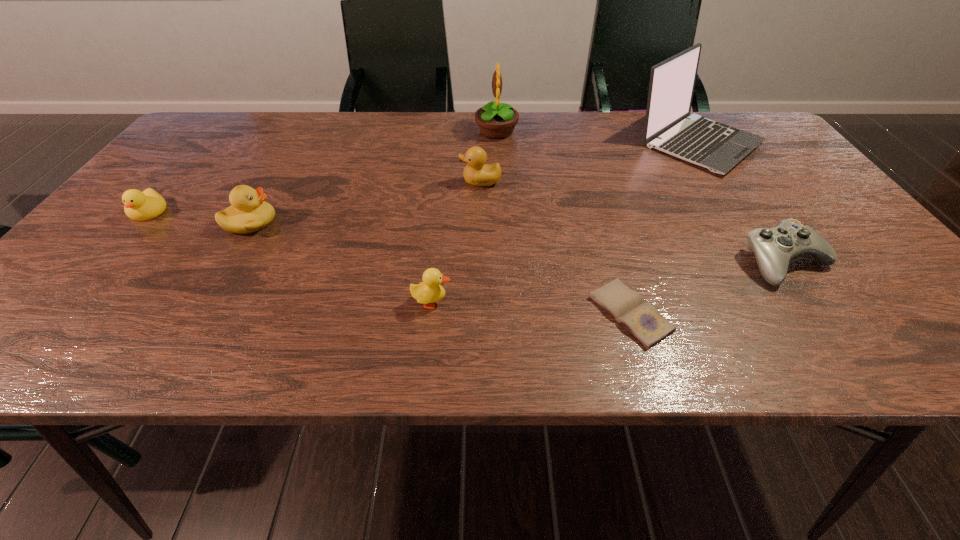
You are a GUI agent. You are given a task and a screenshot of the screen. Output one action in this format:
    pyautogui.click(x=<x>, y=<y>)
    Task: Click on the free space between the diary and the nearest duckling
    This screenshot has height=540, width=960.
    Given the screenshot: What is the action you would take?
    pyautogui.click(x=531, y=308)

Where is `unoccupied position between the laptop_computer and the sunflower`? unoccupied position between the laptop_computer and the sunflower is located at coordinates (597, 137).

You are a GUI agent. You are given a task and a screenshot of the screen. Output one action in this format:
    pyautogui.click(x=<x>, y=<y>)
    Task: Click on the vacant region between the leftmost duckling and the control
    The height and width of the screenshot is (540, 960).
    Given the screenshot: What is the action you would take?
    pyautogui.click(x=467, y=237)

The width and height of the screenshot is (960, 540). I want to click on empty location between the farthest duckling and the shortest object, so click(556, 247).

Locate an element on the screen. free space between the third object from right to left and the second duckling from left to right is located at coordinates (441, 268).

Where is `the second closest object to the leftmost duckling`? the second closest object to the leftmost duckling is located at coordinates (429, 291).

Locate an element on the screen. The image size is (960, 540). object that stands as the seventh closest to the control is located at coordinates (140, 206).

Locate which duckling is the closest to the sunflower. Please provide its 2D coordinates. Your answer should be formatted as a tuple, i.e. [(x, y)], where the tuple contains the x and y coordinates of a point satisfying the conditions above.

[(477, 173)]

You are a GUI agent. You are given a task and a screenshot of the screen. Output one action in this format:
    pyautogui.click(x=<x>, y=<y>)
    Task: Click on the duckling that is the third closest one to the farthest duckling
    This screenshot has width=960, height=540.
    Given the screenshot: What is the action you would take?
    pyautogui.click(x=140, y=206)

The height and width of the screenshot is (540, 960). Find the location of `free region that satisfies the following two spatial constraints: 1. on the back side of the control; 2. on the face of the sunflower`. free region that satisfies the following two spatial constraints: 1. on the back side of the control; 2. on the face of the sunflower is located at coordinates 695,131.